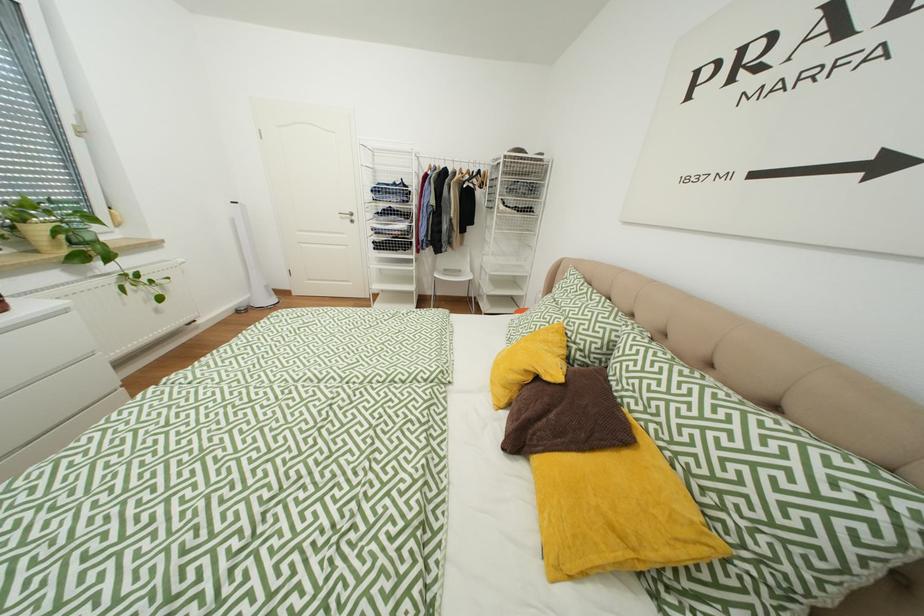
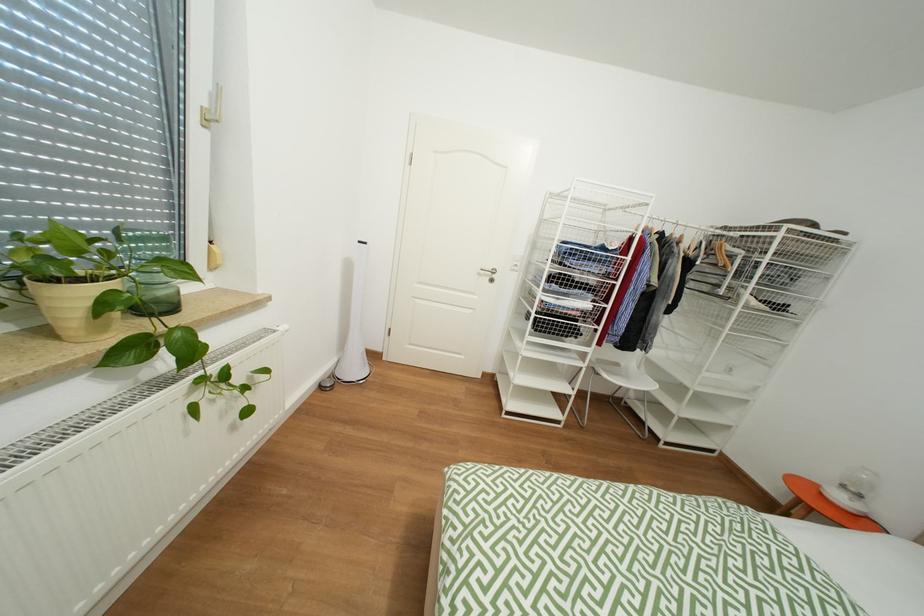
In a continuous first-person perspective shot, in which direction is the camera moving?

The cameraman moved toward left, forward.